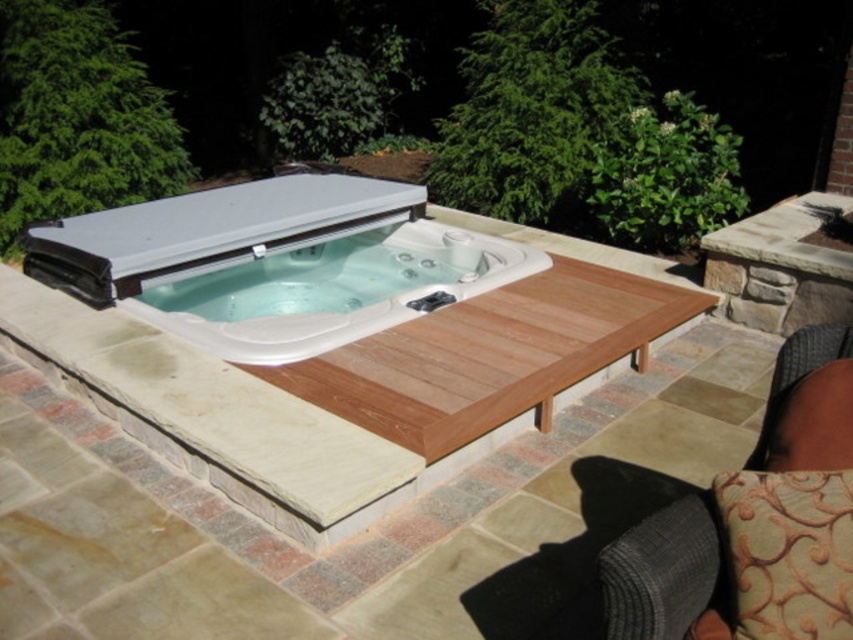
You are standing at the edge of the hot tub platform and want to reach both the point at coordinates point [631,324] and point [825,356]. Which point will you reach first as you move forward?

You will reach point [631,324] first because it is closer to you than point [825,356], which is further away.

In the scene shown: You are standing on the wooden deck looking at the hot tub and the two points marked in the image. Which of the two points, point (378, 362) or point (367, 230), is closer to you?

Point (378, 362) is closer to the viewer than point (367, 230).